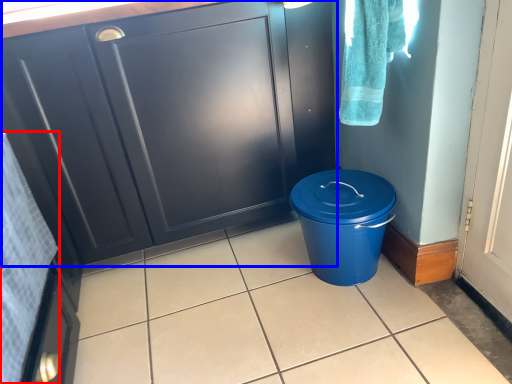
Question: Which of the following is the closest to the observer, bath towel (highlighted by a red box) or cabinetry (highlighted by a blue box)?

Choices:
 (A) bath towel
 (B) cabinetry

Answer: (A)